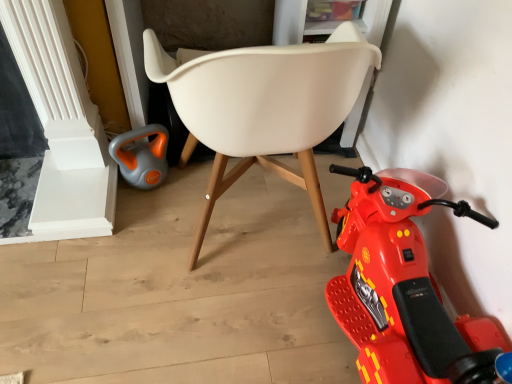
The width and height of the screenshot is (512, 384). I want to click on free point below white plastic chair at center (from a real-world perspective), so click(256, 228).